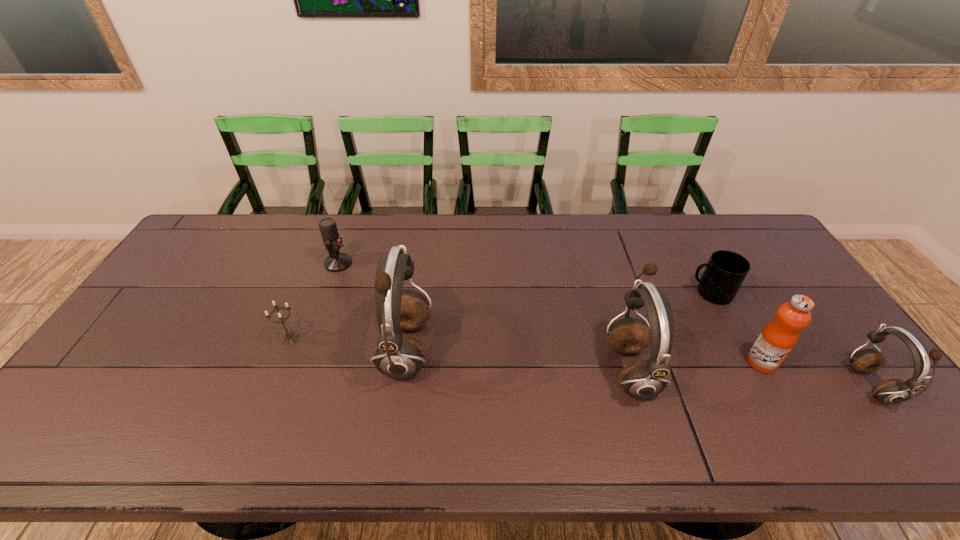
Where is `the fifth object from right to left`? The width and height of the screenshot is (960, 540). the fifth object from right to left is located at coordinates (399, 356).

The height and width of the screenshot is (540, 960). Identify the location of the second tallest earphone. (642, 379).

Where is `the second earphone from right to left`? This screenshot has width=960, height=540. the second earphone from right to left is located at coordinates (642, 379).

Image resolution: width=960 pixels, height=540 pixels. Identify the location of the shortest earphone. (889, 391).

Image resolution: width=960 pixels, height=540 pixels. In order to click on the fourth shortest object in this screenshot , I will do `click(889, 391)`.

The height and width of the screenshot is (540, 960). What are the coordinates of `the sixth nearest object` in the screenshot? It's located at (725, 271).

You are a GUI agent. You are given a task and a screenshot of the screen. Output one action in this format:
    pyautogui.click(x=<x>, y=<y>)
    Task: Click on the candle holder
    
    Given the screenshot: What is the action you would take?
    pyautogui.click(x=288, y=335)

The width and height of the screenshot is (960, 540). I want to click on microphone, so click(335, 262).

Where is `the farthest object`? The width and height of the screenshot is (960, 540). the farthest object is located at coordinates (335, 262).

In order to click on fruit juice in this screenshot , I will do `click(778, 337)`.